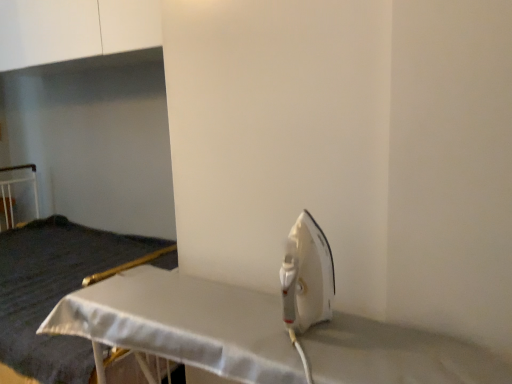
Find the location of a particular element. The height and width of the screenshot is (384, 512). dark gray fabric bed at lower left is located at coordinates (59, 290).

Measure the distance between dark gray fabric bed at lower left and camera.

They are 4.63 feet apart.

Describe the element at coordinates (59, 290) in the screenshot. I see `dark gray fabric bed at lower left` at that location.

You are a GUI agent. You are given a task and a screenshot of the screen. Output one action in this format:
    pyautogui.click(x=<x>, y=<y>)
    Task: Click on the dark gray fabric bed at lower left
    This screenshot has width=512, height=384.
    Given the screenshot: What is the action you would take?
    pyautogui.click(x=59, y=290)